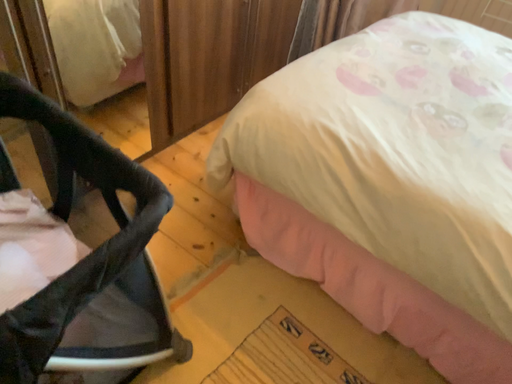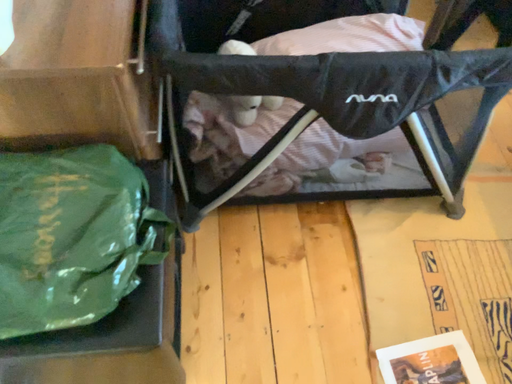
Question: Which way did the camera rotate in the video?

Choices:
 (A) rotated left
 (B) rotated right

Answer: (A)